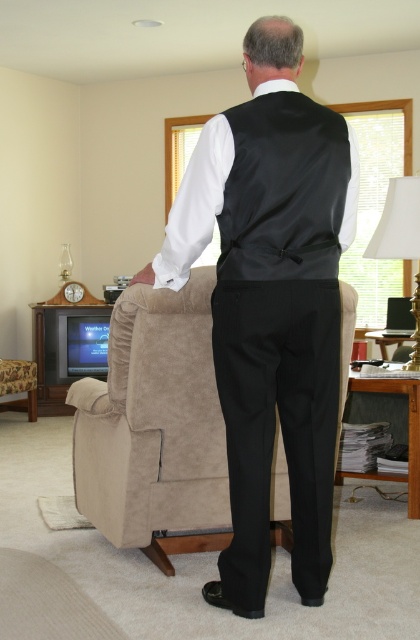
You are an interior designer assessing the room layout. You notice the satin black vest at center and the white fabric lampshade at upper right. Which object takes up more space in the room?

The satin black vest at center is bigger than the white fabric lampshade at upper right, so it takes up more space in the room.

You are a tailor measuring fabrics for alterations. You have a piece of fabric that is exactly the width of the white fabric lampshade at upper right. Can you use this fabric to make a new vest that matches the width of the satin black vest at center?

The satin black vest at center is wider than the white fabric lampshade at upper right. Since the fabric you have matches the lampshade, it won not be wide enough to create a vest with the same width as the satin black vest at center.

You are a photographer positioned in front of the satin black vest at center. You want to take a photo of it without moving the vest. What is the minimum distance you need to move backward to ensure the vest fills the frame properly?

The satin black vest at center is 2.49 meters from the camera. To ensure the vest fills the frame properly without moving it, you should move backward to maintain this distance, as the vest is already positioned at an optimal distance of approximately 2.49 meters.